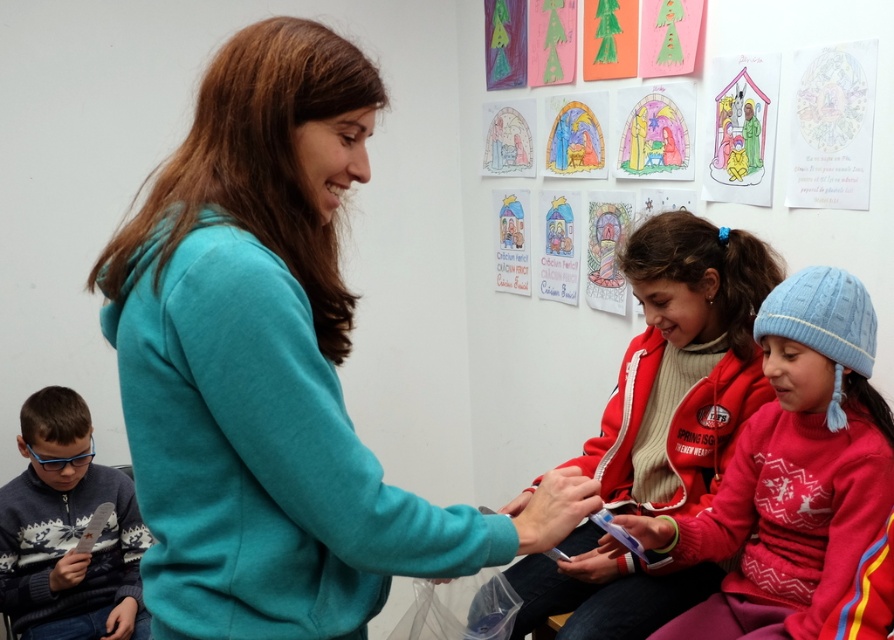
Question: Can you confirm if red knit sweater at center is positioned below blue knitted sweater at lower left?

Choices:
 (A) yes
 (B) no

Answer: (B)

Question: Where is red fleece jacket at center located in relation to blue knitted sweater at lower left in the image?

Choices:
 (A) left
 (B) right

Answer: (B)

Question: Among these points, which one is farthest from the camera?

Choices:
 (A) (36, 593)
 (B) (719, 301)
 (C) (648, 556)

Answer: (A)

Question: Which is nearer to the teal soft hoodie at center?

Choices:
 (A) blue knitted sweater at lower left
 (B) red fleece jacket at center

Answer: (B)

Question: Is red fleece jacket at center thinner than red knit sweater at center?

Choices:
 (A) yes
 (B) no

Answer: (B)

Question: Which point appears farthest from the camera in this image?

Choices:
 (A) (694, 307)
 (B) (30, 513)
 (C) (811, 502)

Answer: (B)